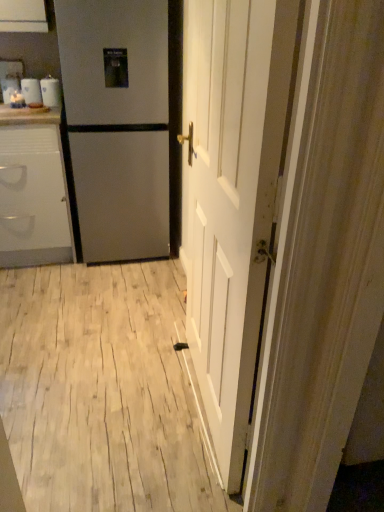
This screenshot has width=384, height=512. Identify the location of vacant space in white wooden door at center (from a real-world perspective). (196, 403).